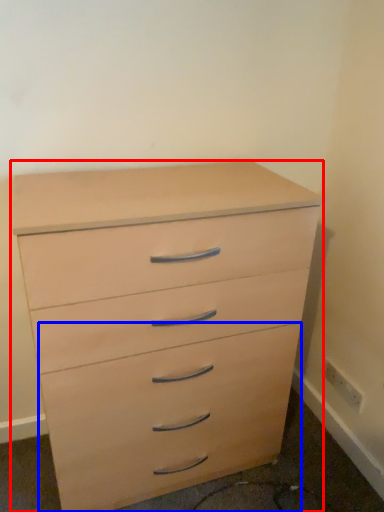
Question: Which point is further to the camera, chest of drawers (highlighted by a red box) or drawer (highlighted by a blue box)?

Choices:
 (A) chest of drawers
 (B) drawer

Answer: (B)